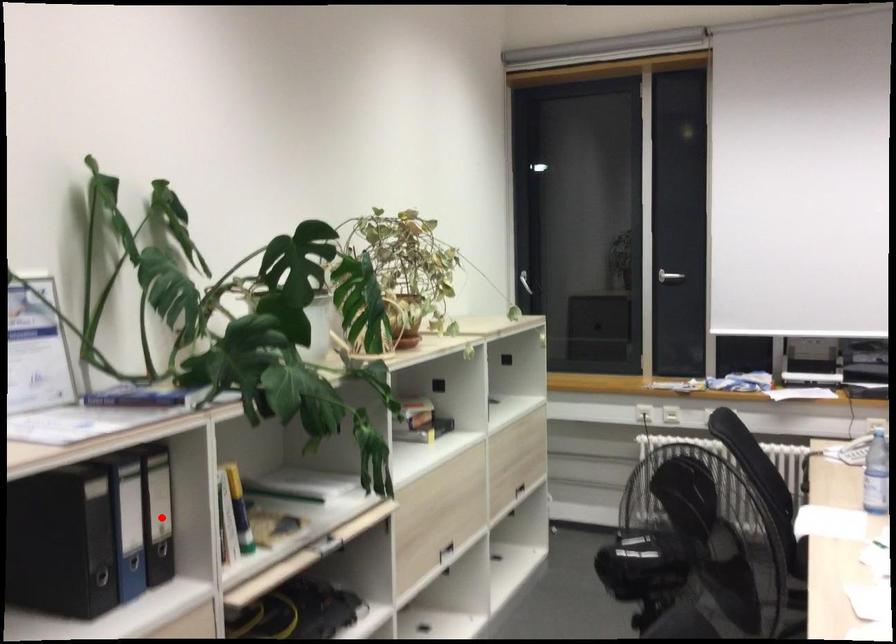
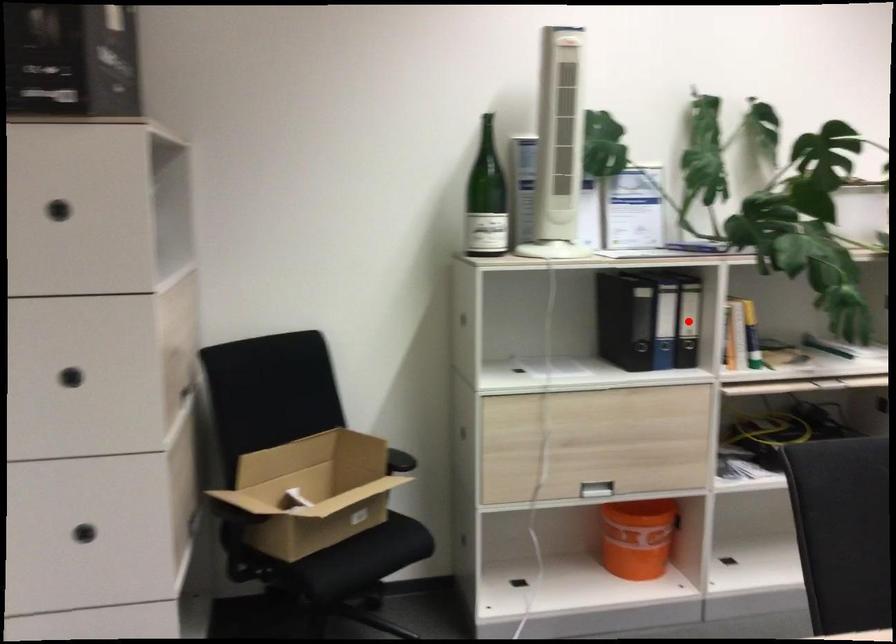
I am providing you with two images of the same scene from different viewpoints. A red point is marked on the first image and another point is marked on the second image. Is the red point in image1 aligned with the point shown in image2?

Yes